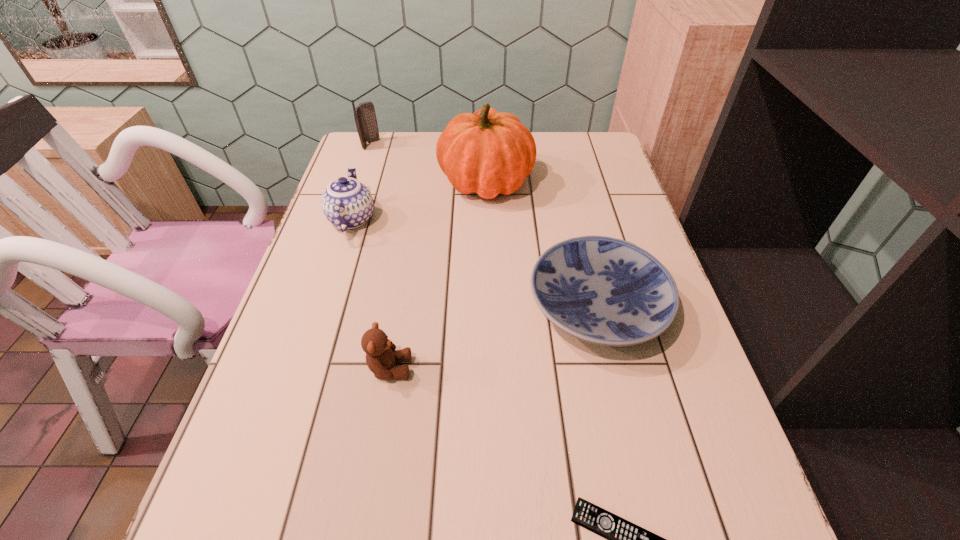
Locate an element on the screen. This screenshot has height=540, width=960. vacant space at the far edge of the desktop is located at coordinates (553, 137).

Image resolution: width=960 pixels, height=540 pixels. In order to click on free space at the left edge in this screenshot , I will do `click(325, 228)`.

Locate an element on the screen. This screenshot has height=540, width=960. blank area at the right edge is located at coordinates (595, 205).

This screenshot has height=540, width=960. In order to click on vacant space at the far right corner in this screenshot , I will do `click(583, 132)`.

Locate an element on the screen. free space that is in between the teddy bear and the plate is located at coordinates (493, 338).

Identify the location of empty space that is in between the chinaware and the farthest object. (362, 182).

You are a GUI agent. You are given a task and a screenshot of the screen. Output one action in this format:
    pyautogui.click(x=<x>, y=<y>)
    Task: Click on the vacant space in between the third shortest object and the cellular telephone
    
    Given the screenshot: What is the action you would take?
    pyautogui.click(x=380, y=256)

The width and height of the screenshot is (960, 540). Find the location of `free space between the chinaware and the fourth tallest object`. free space between the chinaware and the fourth tallest object is located at coordinates (371, 294).

Locate an element on the screen. The image size is (960, 540). unoccupied position between the second tallest object and the chinaware is located at coordinates (362, 182).

The height and width of the screenshot is (540, 960). I want to click on object that is the nearest to the farthest object, so click(489, 153).